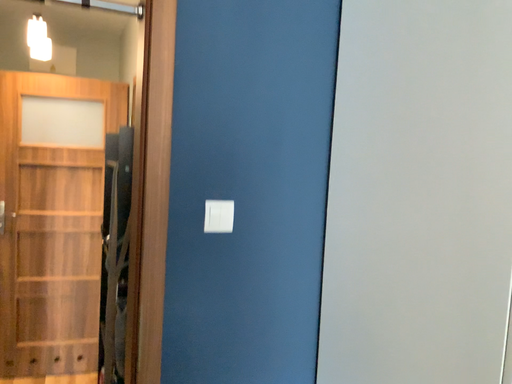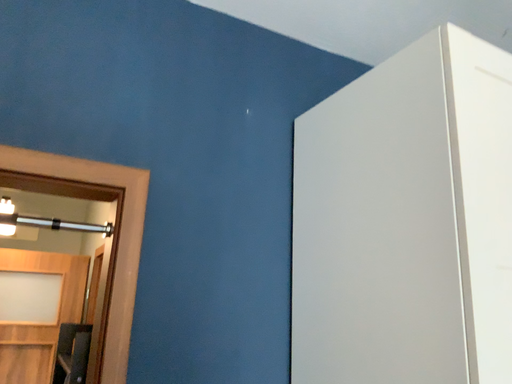
Question: Which way did the camera rotate in the video?

Choices:
 (A) rotated upward
 (B) rotated downward

Answer: (A)